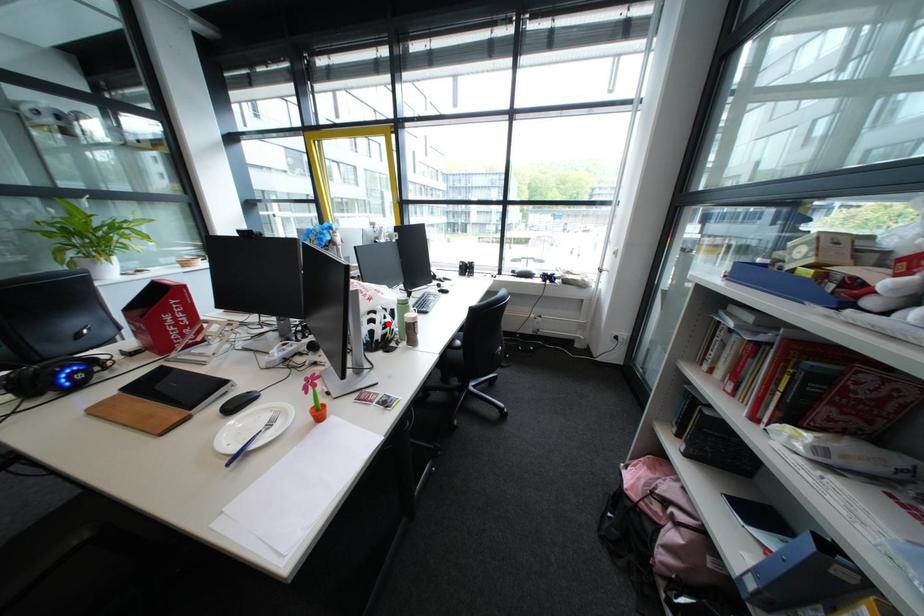
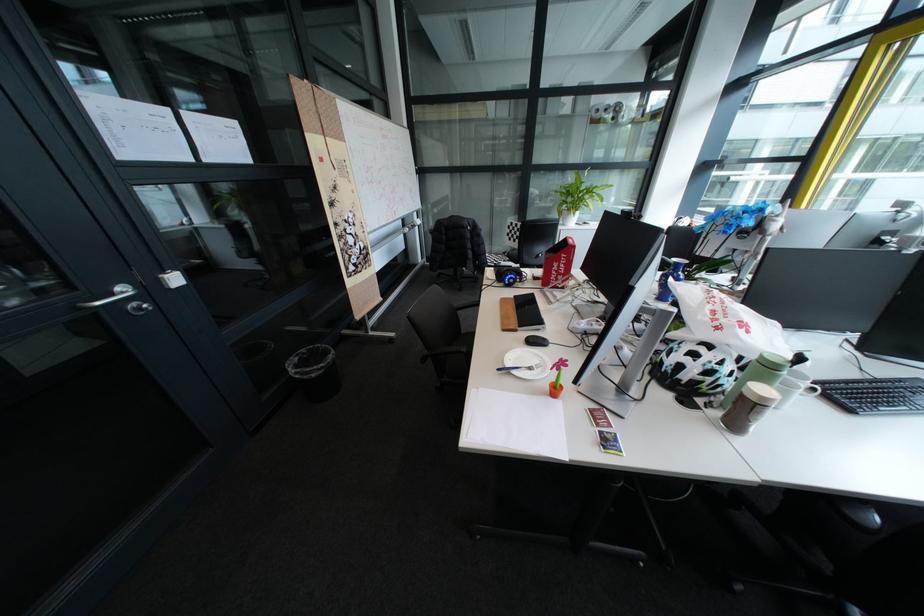
Where in the second image is the point corresponding to the highlighted location from the first image?

(709, 361)